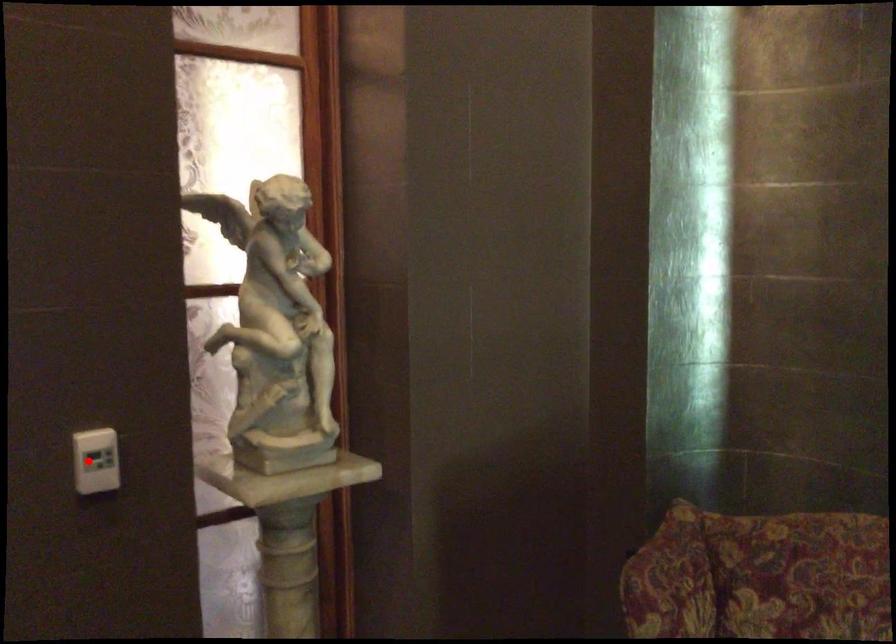
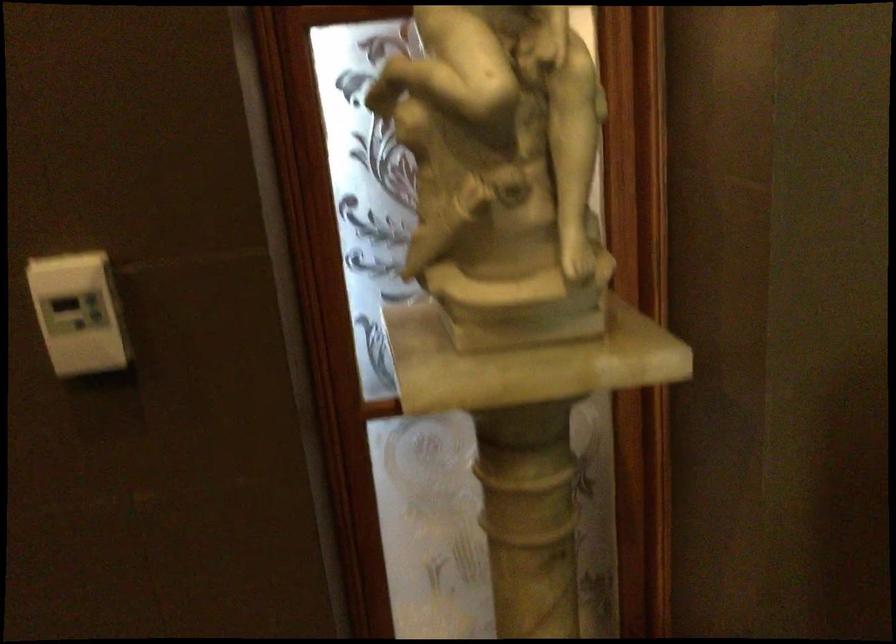
Question: I am providing you with two images of the same scene from different viewpoints. Image1 has a red point marked. In image2, the corresponding 3D location appears at what relative position? Reply with the corresponding letter.

Choices:
 (A) Closer
 (B) Farther

Answer: (A)